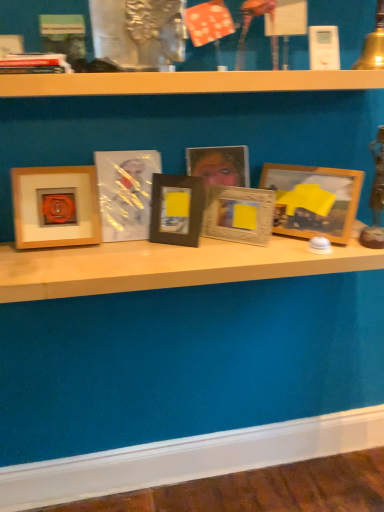
Image resolution: width=384 pixels, height=512 pixels. I want to click on free area below wooden shelf at upper center (from a real-world perspective), so click(x=172, y=248).